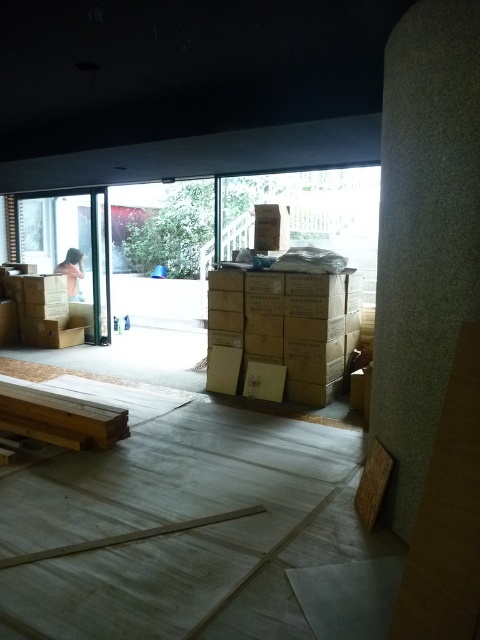
Is transparent glass door at left smaller than matte brown cardboard box at center?

Incorrect, transparent glass door at left is not smaller in size than matte brown cardboard box at center.

Which is in front, point (100, 212) or point (253, 244)?

Point (253, 244) is more forward.

This screenshot has height=640, width=480. What do you see at coordinates (72, 248) in the screenshot?
I see `transparent glass door at left` at bounding box center [72, 248].

The width and height of the screenshot is (480, 640). What are the coordinates of `transparent glass door at left` in the screenshot? It's located at (72, 248).